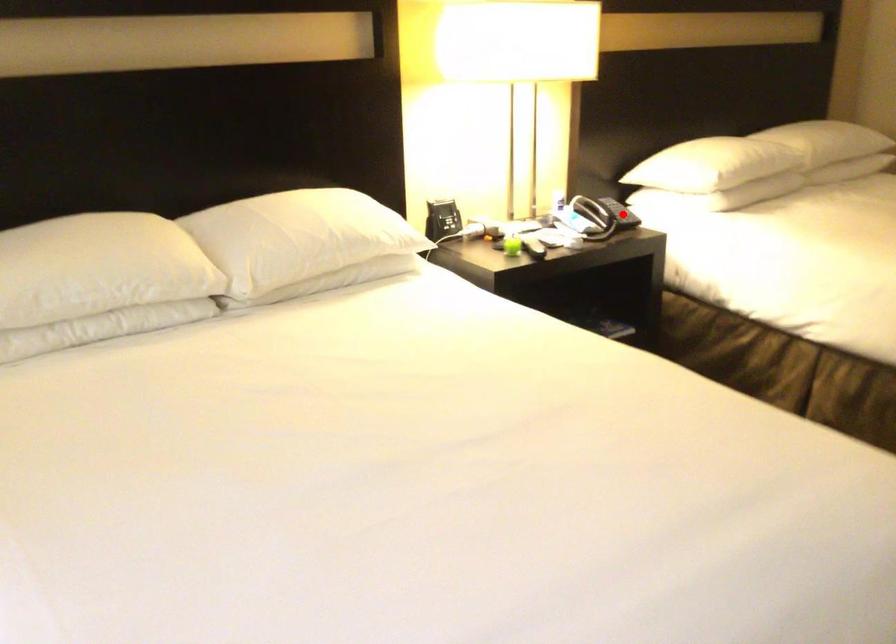
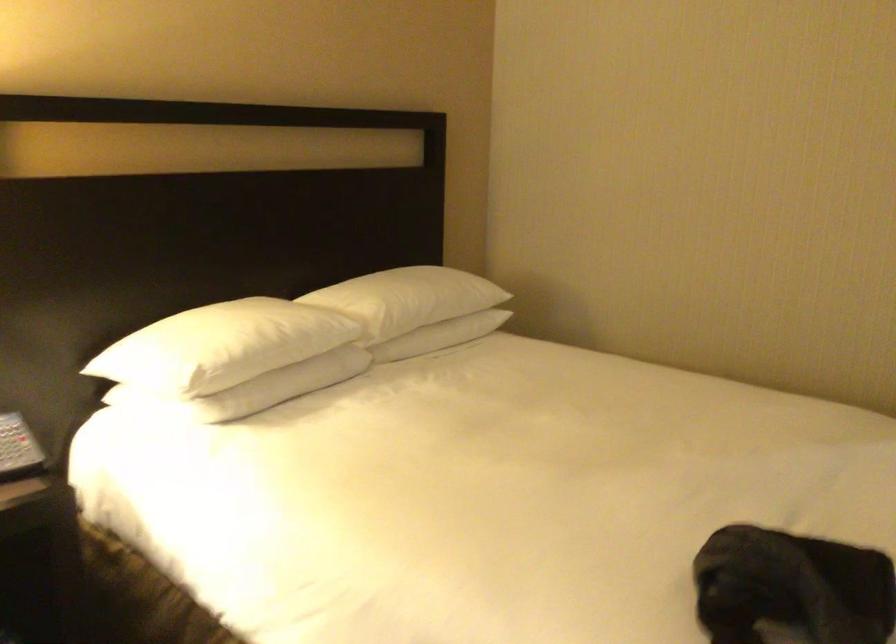
Find the pixel in the second image that matches the highlighted location in the first image.

(15, 448)